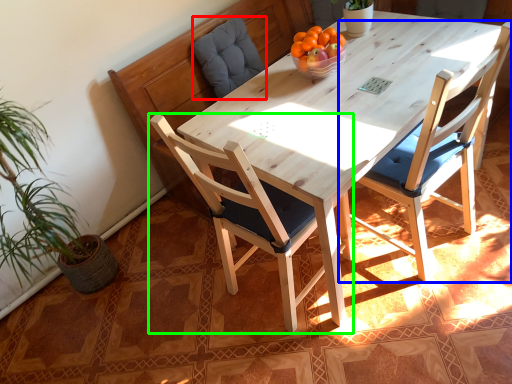
Question: Which object is the farthest from swivel chair (highlighted by a red box)? Choose among these: chair (highlighted by a blue box) or chair (highlighted by a green box).

Choices:
 (A) chair
 (B) chair

Answer: (A)